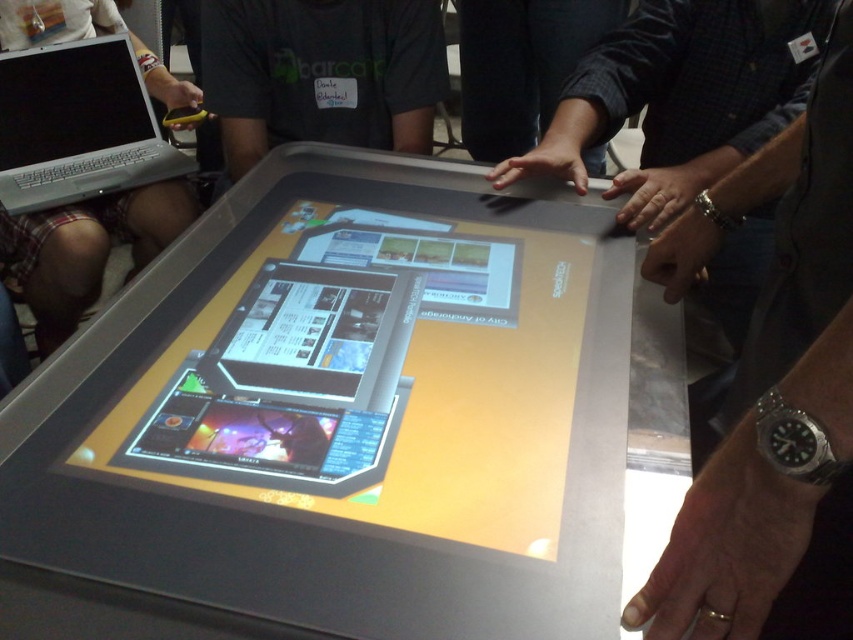
Question: Does metallic silver watch at lower right have a larger size compared to silver metallic laptop at upper left?

Choices:
 (A) yes
 (B) no

Answer: (A)

Question: Does black fabric shirt at upper center have a smaller size compared to silver metallic laptop at upper left?

Choices:
 (A) yes
 (B) no

Answer: (A)

Question: Which point is farther to the camera?

Choices:
 (A) (163, 538)
 (B) (358, 88)
 (C) (47, 74)
 (D) (820, 436)

Answer: (C)

Question: Which point is closer to the camera?

Choices:
 (A) (357, 49)
 (B) (140, 288)
 (C) (30, 186)
 (D) (750, 435)

Answer: (D)

Question: Among these objects, which one is nearest to the camera?

Choices:
 (A) metallic silver watch at lower right
 (B) black fabric shirt at upper center
 (C) transparent plastic table at center

Answer: (A)

Question: Is transparent plastic table at center positioned at the back of black fabric shirt at upper center?

Choices:
 (A) no
 (B) yes

Answer: (A)